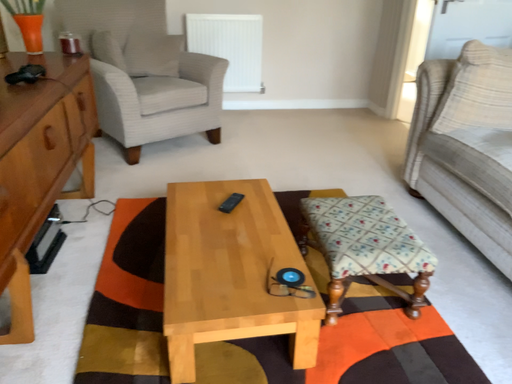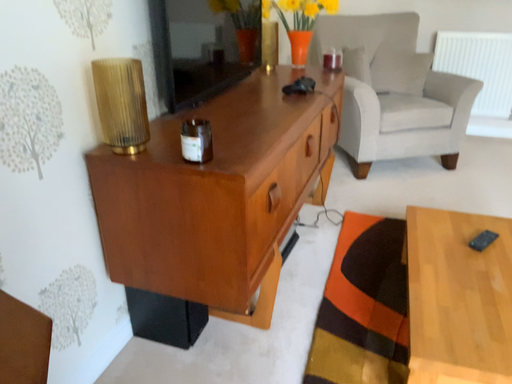
Question: How did the camera likely rotate when shooting the video?

Choices:
 (A) rotated right
 (B) rotated left

Answer: (B)